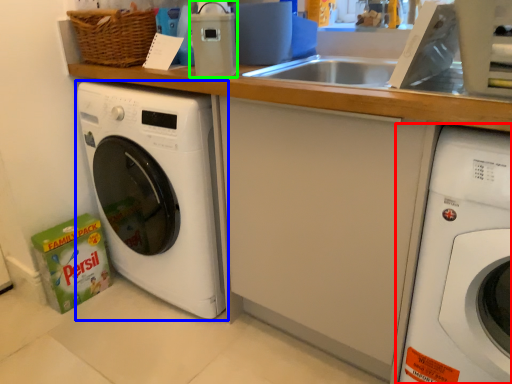
Question: Which object is the farthest from washing machine (highlighted by a red box)? Choose among these: washing machine (highlighted by a blue box) or appliance (highlighted by a green box).

Choices:
 (A) washing machine
 (B) appliance

Answer: (A)